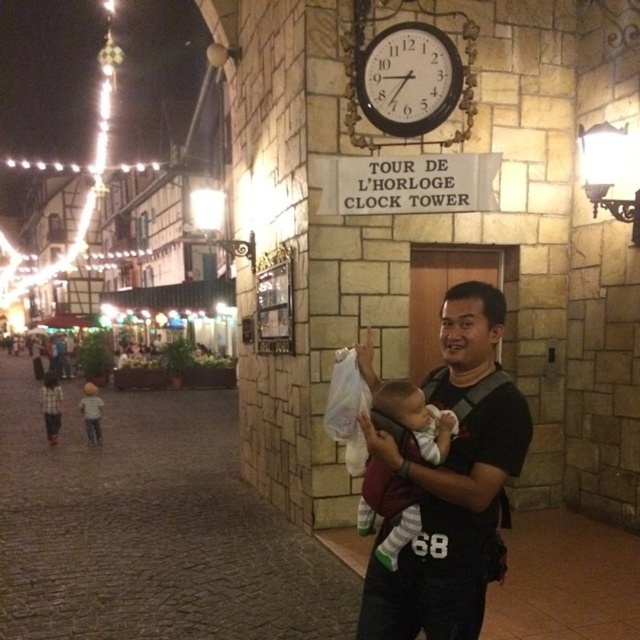
Is soft white baby at center shorter than light brown hair at left?

Correct, soft white baby at center is not as tall as light brown hair at left.

Who is more distant from viewer, (369, 516) or (92, 426)?

Point (92, 426)

This screenshot has width=640, height=640. In order to click on soft white baby at center in this screenshot , I will do `click(387, 509)`.

Looking at this image, which is below, black fabric baby carrier at center or black metal clock at upper center?

black fabric baby carrier at center

Based on the photo, can you confirm if black fabric baby carrier at center is shorter than black metal clock at upper center?

In fact, black fabric baby carrier at center may be taller than black metal clock at upper center.

Does point (412, 625) come closer to viewer compared to point (413, 49)?

Yes, point (412, 625) is in front of point (413, 49).

In order to click on black fabric baby carrier at center in this screenshot , I will do `click(452, 483)`.

Is black metal clock at upper center positioned behind light brown hair at left?

No, it is not.

Does black metal clock at upper center have a greater width compared to light brown hair at left?

No, black metal clock at upper center is not wider than light brown hair at left.

Who is more forward, (426, 100) or (93, 416)?

Point (426, 100) is more forward.

Locate an element on the screen. The width and height of the screenshot is (640, 640). black metal clock at upper center is located at coordinates (408, 77).